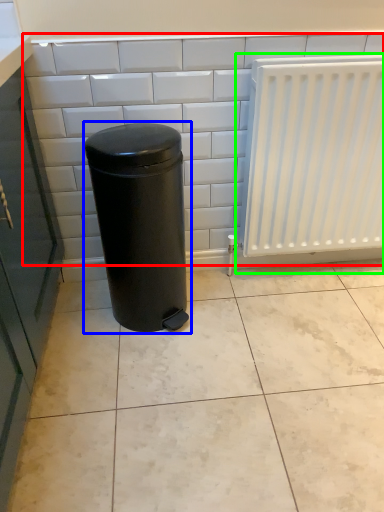
Question: Based on their relative distances, which object is nearer to ceramic tile (highlighted by a red box)? Choose from waste container (highlighted by a blue box) and radiator (highlighted by a green box).

Choices:
 (A) waste container
 (B) radiator

Answer: (A)